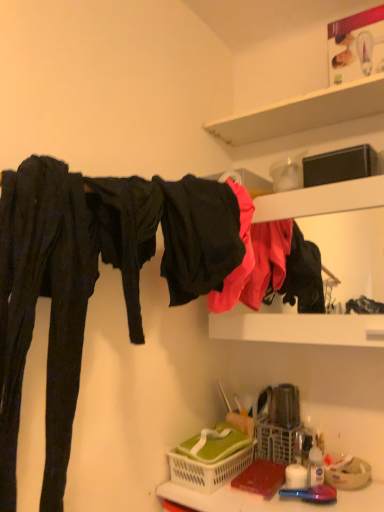
Question: Is matte black clothing at upper right inside white plastic basket at lower center, the second basket when ordered from left to right?

Choices:
 (A) yes
 (B) no

Answer: (B)

Question: Does white plastic basket at lower center, the first basket in the right-to-left sequence, have a lesser width compared to matte black clothing at upper right?

Choices:
 (A) yes
 (B) no

Answer: (A)

Question: From the image's perspective, is white plastic basket at lower center, the second basket when ordered from left to right, over matte black clothing at upper right?

Choices:
 (A) yes
 (B) no

Answer: (B)

Question: From the image's perspective, is white plastic basket at lower center, the second basket when ordered from left to right, beneath matte black clothing at upper right?

Choices:
 (A) yes
 (B) no

Answer: (A)

Question: Does white plastic basket at lower center, the first basket in the right-to-left sequence, lie in front of matte black clothing at upper right?

Choices:
 (A) no
 (B) yes

Answer: (A)

Question: From the image's perspective, is white plastic basket at lower center, the second basket when ordered from left to right, located above or below translucent plastic basket at lower center?

Choices:
 (A) below
 (B) above

Answer: (B)

Question: From their relative heights in the image, would you say white plastic basket at lower center, the second basket when ordered from left to right, is taller or shorter than translucent plastic basket at lower center?

Choices:
 (A) tall
 (B) short

Answer: (A)

Question: Looking at the image, does white plastic basket at lower center, the second basket when ordered from left to right, seem bigger or smaller compared to translucent plastic basket at lower center?

Choices:
 (A) small
 (B) big

Answer: (B)

Question: In terms of width, does white plastic basket at lower center, the first basket in the right-to-left sequence, look wider or thinner when compared to translucent plastic basket at lower center?

Choices:
 (A) thin
 (B) wide

Answer: (A)

Question: Visually, is black matte fabric at upper center positioned to the left or to the right of white plastic basket at lower center, the second basket when ordered from left to right?

Choices:
 (A) right
 (B) left

Answer: (B)

Question: Looking at the image, does black matte fabric at upper center seem bigger or smaller compared to white plastic basket at lower center, the first basket in the right-to-left sequence?

Choices:
 (A) big
 (B) small

Answer: (A)

Question: From a real-world perspective, relative to white plastic basket at lower center, the first basket in the right-to-left sequence, is black matte fabric at upper center vertically above or below?

Choices:
 (A) above
 (B) below

Answer: (A)

Question: Is point (192, 204) positioned closer to the camera than point (294, 436)?

Choices:
 (A) closer
 (B) farther

Answer: (A)

Question: Is point (231, 315) closer or farther from the camera than point (276, 500)?

Choices:
 (A) closer
 (B) farther

Answer: (B)

Question: In the image, is matte black clothing at upper right on the left side or the right side of translucent plastic basket at lower center?

Choices:
 (A) left
 (B) right

Answer: (B)